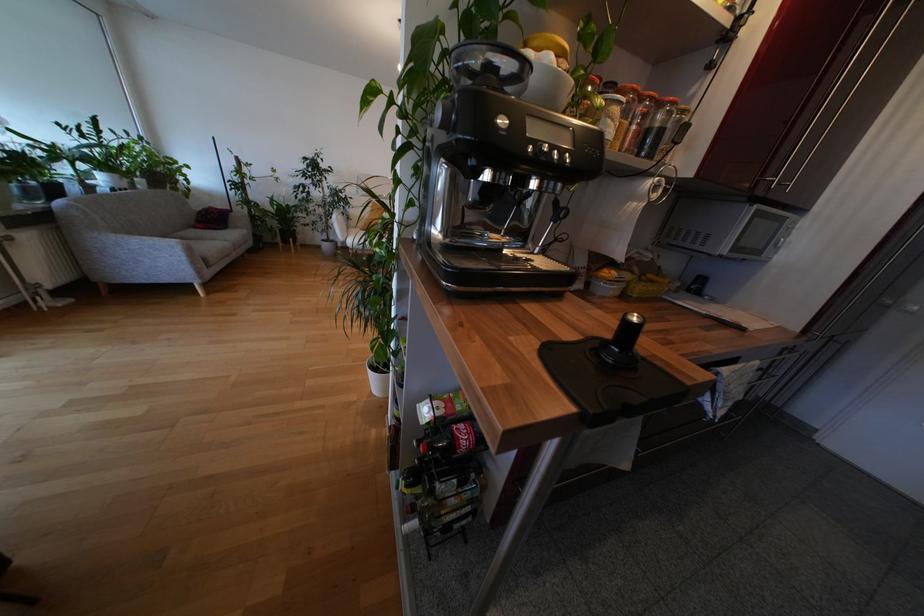
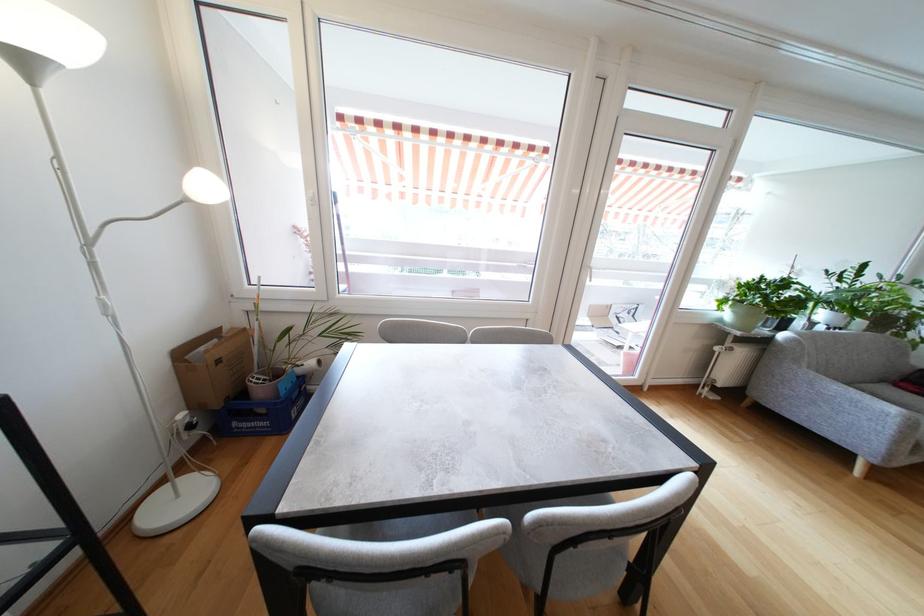
Locate, in the second image, the point that corresponds to [118,192] in the first image.

(833, 330)